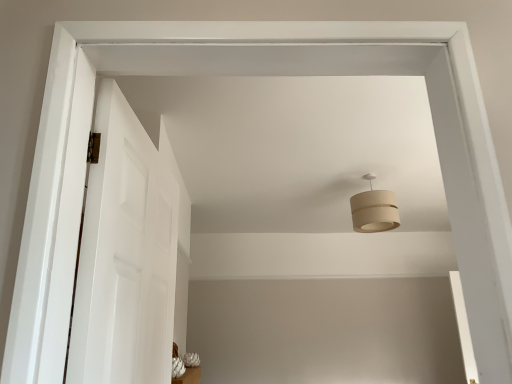
Question: Is white smooth door at left spatially inside white glossy vase at lower center, or outside of it?

Choices:
 (A) inside
 (B) outside

Answer: (B)

Question: From the image's perspective, relative to white glossy vase at lower center, is white smooth door at left above or below?

Choices:
 (A) above
 (B) below

Answer: (A)

Question: Based on their relative distances, which object is nearer to the beige fabric lampshade at upper center?

Choices:
 (A) white glossy vase at lower center
 (B) white smooth door at left

Answer: (B)

Question: Which object is the closest to the white smooth door at left?

Choices:
 (A) beige fabric lampshade at upper center
 (B) white glossy vase at lower center

Answer: (A)